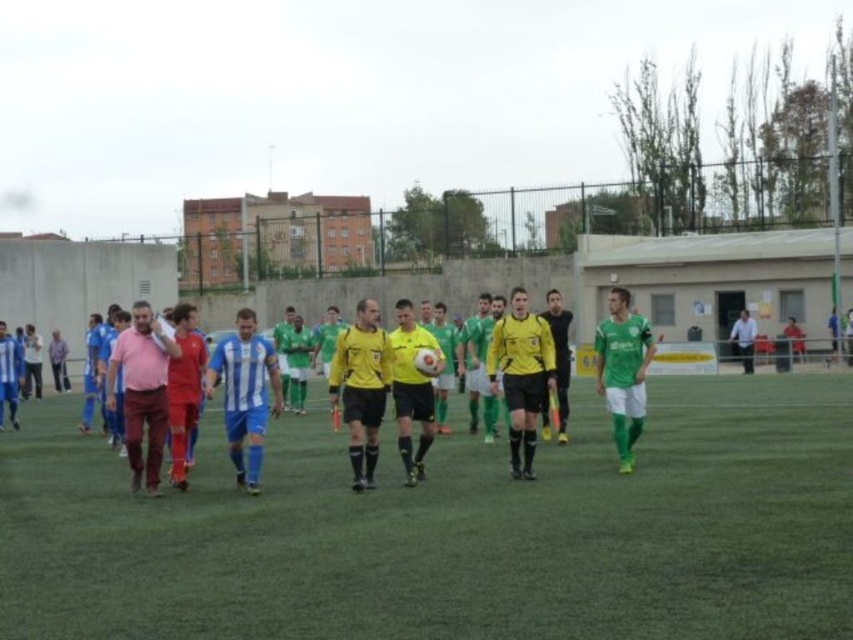
Question: Does green artificial turf at center have a greater width compared to yellow matte jersey at center?

Choices:
 (A) yes
 (B) no

Answer: (A)

Question: Which object is the farthest from the green jersey at center?

Choices:
 (A) yellow jersey at center
 (B) pink matte shirt at center
 (C) yellow matte jersey at center

Answer: (B)

Question: Is green artificial turf at center bigger than green jersey at center?

Choices:
 (A) yes
 (B) no

Answer: (B)

Question: Considering the real-world distances, which object is farthest from the green artificial turf at center?

Choices:
 (A) pink matte shirt at center
 (B) yellow matte jersey at center

Answer: (A)

Question: Which point is closer to the camera?

Choices:
 (A) (369, 477)
 (B) (409, 310)
 (C) (560, 356)

Answer: (A)

Question: Does pink matte shirt at center appear on the right side of yellow matte jersey at center?

Choices:
 (A) yes
 (B) no

Answer: (B)